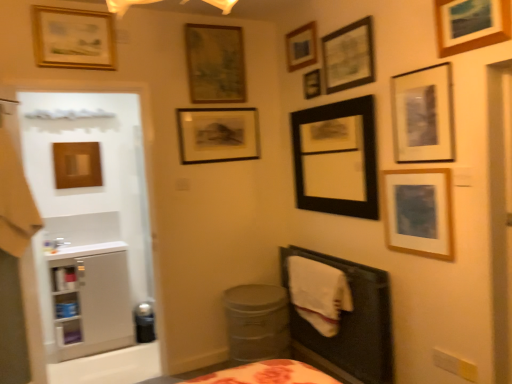
Locate an element on the screen. The width and height of the screenshot is (512, 384). empty space that is ontop of wooden textured picture frame at upper center, which appears as the 9th picture frame when viewed from the right (from a real-world perspective) is located at coordinates (212, 25).